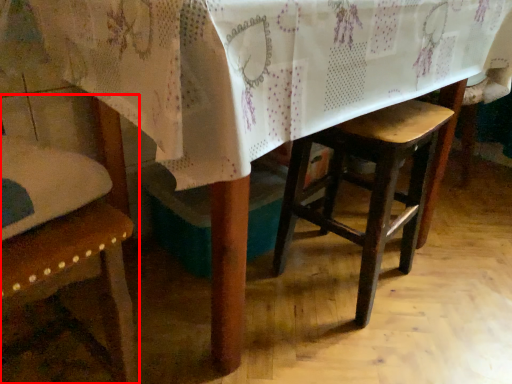
Question: From the image's perspective, where is chair (annotated by the red box) located in relation to stool in the image?

Choices:
 (A) below
 (B) above

Answer: (A)